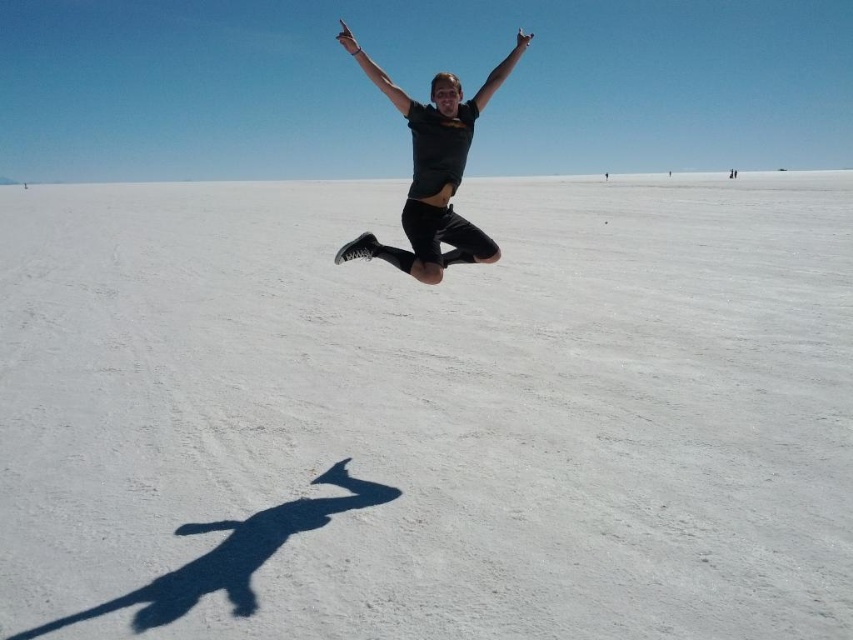
Based on the photo, you are a photographer trying to capture the perfect shot of the person jumping on the salt flat. You notice the white matte snow at center and the matte black arm at upper center in your viewfinder. Which object is closer to the camera?

The white matte snow at center is positioned under the matte black arm at upper center, meaning it is closer to the camera since it is below and in front of the arm.

You are standing on the salt flat and see the white matte snow at center and the black matte shirt at center. Which object is closer to you?

The white matte snow at center is positioned over the black matte shirt at center, so the white matte snow at center is closer to you.

You are a photographer trying to capture the perfect shot of the person jumping. You notice the black matte shirt at center and the matte black arm at upper center. Which object appears narrower in the photo?

The black matte shirt at center appears narrower than the matte black arm at upper center because its width is less than that of the matte black arm at upper center.